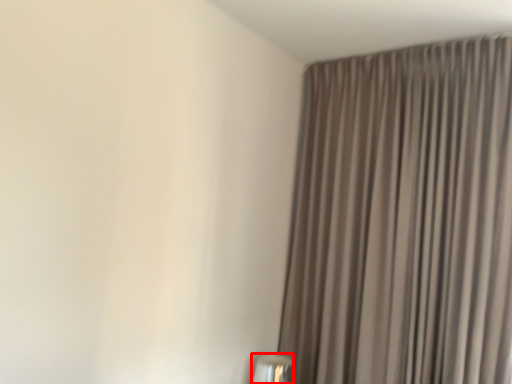
Question: Where is table lamp (annotated by the red box) located in relation to curtain in the image?

Choices:
 (A) left
 (B) right

Answer: (A)